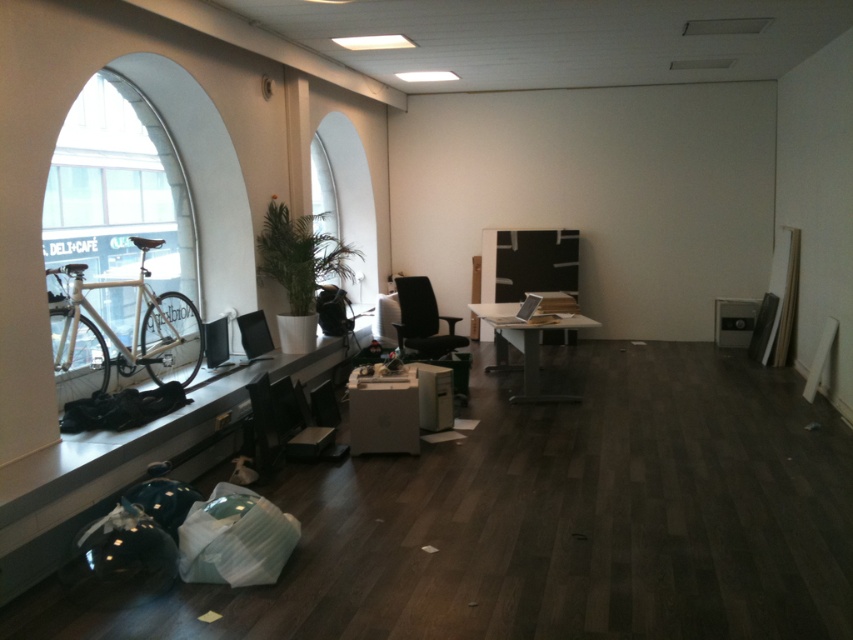
You are a person who is 1.7 meters tall. You are sitting on the black leather chair at center and want to reach the silver metallic tablet at center to pick it up. Can you do this without standing up?

The black leather chair at center is taller than the silver metallic tablet at center, so yes, you can reach the silver metallic tablet at center while sitting because the tablet is lower than the chair.